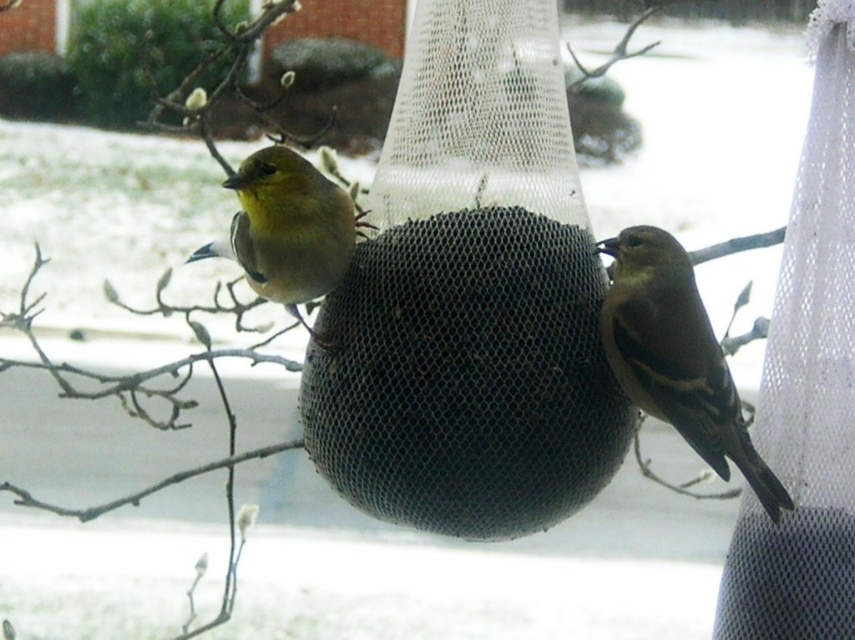
Looking at this image, you are a photographer trying to capture a clear photo of both the brown matte sparrow at center and the yellow matte bird at center. Since you want to focus on the one that is lower, which bird should you aim your camera at?

The brown matte sparrow at center is below the yellow matte bird at center, so you should aim your camera at the brown matte sparrow at center to focus on the lower one.

You are observing two points in the winter scene. The first point is at coordinates point [691,353] and the second is at point [268,186]. From your viewpoint, which point is closer to you?

Point [691,353] is in front of point [268,186], so it is closer to you.